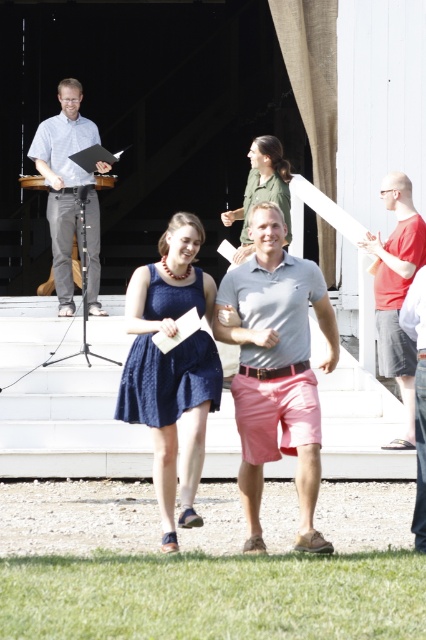
Question: Is the position of navy blue dress at center less distant than that of matte green shirt at center?

Choices:
 (A) no
 (B) yes

Answer: (B)

Question: Which point is closer to the camera?

Choices:
 (A) light blue shirt at left
 (B) gray cotton polo shirt at center
 (C) matte green shirt at center

Answer: (B)

Question: Considering the relative positions of navy blue dress at center and matte green shirt at center in the image provided, where is navy blue dress at center located with respect to matte green shirt at center?

Choices:
 (A) right
 (B) left

Answer: (B)

Question: Considering the real-world distances, which object is farthest from the matte green shirt at center?

Choices:
 (A) gray cotton polo shirt at center
 (B) light blue shirt at left
 (C) navy blue dress at center

Answer: (A)

Question: Which point appears farthest from the camera in this image?

Choices:
 (A) (213, 381)
 (B) (236, 269)
 (C) (273, 195)

Answer: (C)

Question: Does navy blue dress at center lie in front of light blue shirt at left?

Choices:
 (A) no
 (B) yes

Answer: (B)